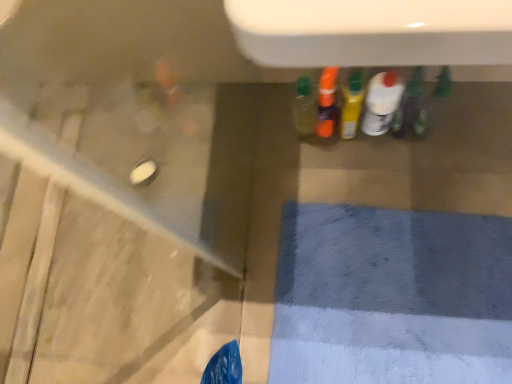
You are a GUI agent. You are given a task and a screenshot of the screen. Output one action in this format:
    pyautogui.click(x=<x>, y=<y>)
    Task: Click on the free space in front of green matte bottle at center, which ranks as the 5th bottle in left-to-right order
    The width and height of the screenshot is (512, 384).
    Given the screenshot: What is the action you would take?
    pyautogui.click(x=430, y=176)